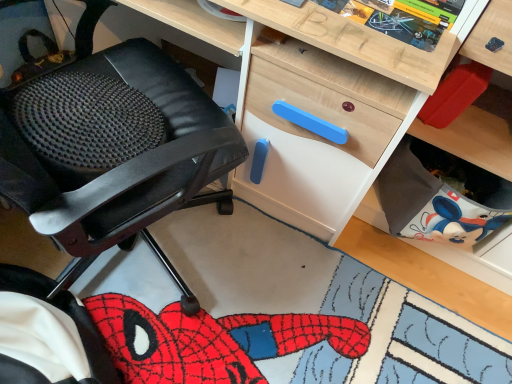
What is the approximate height of wooden comic book at upper center?

wooden comic book at upper center is 0.48 inches in height.

Describe the element at coordinates (398, 20) in the screenshot. I see `wooden comic book at upper center` at that location.

Find the location of a particular element. The width and height of the screenshot is (512, 384). wooden comic book at upper center is located at coordinates (x=398, y=20).

Image resolution: width=512 pixels, height=384 pixels. In order to click on matte black office chair at left in this screenshot , I will do `click(111, 144)`.

The width and height of the screenshot is (512, 384). What do you see at coordinates (111, 144) in the screenshot?
I see `matte black office chair at left` at bounding box center [111, 144].

You are a GUI agent. You are given a task and a screenshot of the screen. Output one action in this format:
    pyautogui.click(x=<x>, y=<y>)
    Task: Click on the wooden comic book at upper center
    The image size is (512, 384).
    Given the screenshot: What is the action you would take?
    pyautogui.click(x=398, y=20)

In the image, is wooden comic book at upper center on the left side or the right side of matte black office chair at left?

wooden comic book at upper center is to the right of matte black office chair at left.

Which object is closer to the camera taking this photo, wooden comic book at upper center or matte black office chair at left?

matte black office chair at left.

Between point (348, 17) and point (21, 182), which one is positioned in front?

The point (21, 182) is more forward.

From the image's perspective, which one is positioned higher, wooden comic book at upper center or matte black office chair at left?

wooden comic book at upper center appears higher in the image.

From a real-world perspective, which object rests below the other?

From a 3D spatial view, matte black office chair at left is below.

Between wooden comic book at upper center and matte black office chair at left, which one has smaller width?

wooden comic book at upper center is thinner.

From their relative heights in the image, would you say wooden comic book at upper center is taller or shorter than matte black office chair at left?

wooden comic book at upper center is shorter than matte black office chair at left.

In terms of size, does wooden comic book at upper center appear bigger or smaller than matte black office chair at left?

wooden comic book at upper center is smaller than matte black office chair at left.

Is wooden comic book at upper center not inside matte black office chair at left?

wooden comic book at upper center is positioned outside matte black office chair at left.

Is the surface of wooden comic book at upper center in direct contact with matte black office chair at left?

wooden comic book at upper center is not next to matte black office chair at left, and they're not touching.

Does wooden comic book at upper center turn towards matte black office chair at left?

Yes, wooden comic book at upper center faces towards matte black office chair at left.

Measure the distance between wooden comic book at upper center and matte black office chair at left.

wooden comic book at upper center is 21.82 inches from matte black office chair at left.

The width and height of the screenshot is (512, 384). Identify the location of chair below the wooden comic book at upper center (from a real-world perspective). (111, 144).

Considering the relative positions of matte black office chair at left and wooden comic book at upper center in the image provided, is matte black office chair at left to the left of wooden comic book at upper center from the viewer's perspective?

Yes, matte black office chair at left is to the left of wooden comic book at upper center.

From the picture: Which object is more forward, matte black office chair at left or wooden comic book at upper center?

matte black office chair at left.

Is point (61, 309) less distant than point (425, 49)?

No, it is behind (425, 49).

From the image's perspective, is matte black office chair at left above or below wooden comic book at upper center?

Based on their image positions, matte black office chair at left is located beneath wooden comic book at upper center.

Looking at this image, from a real-world perspective, who is located higher, matte black office chair at left or wooden comic book at upper center?

In real-world perspective, wooden comic book at upper center is above.

Is matte black office chair at left wider than wooden comic book at upper center?

Indeed, matte black office chair at left has a greater width compared to wooden comic book at upper center.

Can you confirm if matte black office chair at left is taller than wooden comic book at upper center?

Correct, matte black office chair at left is much taller as wooden comic book at upper center.

Is matte black office chair at left bigger than wooden comic book at upper center?

Yes, matte black office chair at left is bigger than wooden comic book at upper center.

Can we say matte black office chair at left lies outside wooden comic book at upper center?

Indeed, matte black office chair at left is completely outside wooden comic book at upper center.

Is matte black office chair at left positioned far away from wooden comic book at upper center?

No.

Is matte black office chair at left facing towards wooden comic book at upper center?

Yes, matte black office chair at left faces towards wooden comic book at upper center.

Find the location of a particular element. chair in front of the wooden comic book at upper center is located at coordinates (111, 144).

You are a GUI agent. You are given a task and a screenshot of the screen. Output one action in this format:
    pyautogui.click(x=<x>, y=<y>)
    Task: Click on the comic book on the right side of matte black office chair at left
    This screenshot has width=512, height=384.
    Given the screenshot: What is the action you would take?
    pyautogui.click(x=398, y=20)

At what (x,y) coordinates should I click in order to perform the action: click on chair lying on the left of wooden comic book at upper center. Please return your answer as a coordinate pair (x, y). This screenshot has width=512, height=384. Looking at the image, I should click on point(111,144).